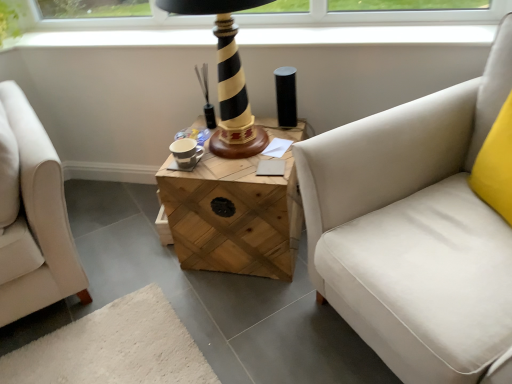
What do you see at coordinates (233, 216) in the screenshot? This screenshot has width=512, height=384. I see `wooden crate at center` at bounding box center [233, 216].

Locate an element on the screen. white fabric studio couch at right is located at coordinates (416, 230).

The width and height of the screenshot is (512, 384). Describe the element at coordinates (416, 230) in the screenshot. I see `white fabric studio couch at right` at that location.

Locate an element on the screen. Image resolution: width=512 pixels, height=384 pixels. wooden crate at center is located at coordinates (233, 216).

In the scene shown: Can you confirm if white fabric studio couch at right is shorter than wooden crate at center?

In fact, white fabric studio couch at right may be taller than wooden crate at center.

Is white fabric studio couch at right in front of wooden crate at center?

Yes, white fabric studio couch at right is in front of wooden crate at center.

Is white fabric studio couch at right turned away from wooden crate at center?

No, white fabric studio couch at right's orientation is not away from wooden crate at center.

From the picture: Considering the relative positions of black striped wood table lamp at center and white fabric studio couch at right in the image provided, is black striped wood table lamp at center to the right of white fabric studio couch at right from the viewer's perspective?

In fact, black striped wood table lamp at center is to the left of white fabric studio couch at right.

From the picture: Between black striped wood table lamp at center and white fabric studio couch at right, which one has smaller size?

black striped wood table lamp at center.

In order to click on table lamp lying behind the white fabric studio couch at right in this screenshot , I will do [x=228, y=78].

Are black striped wood table lamp at center and white fabric studio couch at right located far from each other?

No, black striped wood table lamp at center is not far from white fabric studio couch at right.

Is wooden crate at center next to black striped wood table lamp at center and touching it?

No, wooden crate at center is not making contact with black striped wood table lamp at center.

The image size is (512, 384). What are the coordinates of `table behind the black striped wood table lamp at center` in the screenshot? It's located at 233,216.

From a real-world perspective, which is physically above, wooden crate at center or black striped wood table lamp at center?

black striped wood table lamp at center, from a real-world perspective.

How different are the orientations of black striped wood table lamp at center and wooden crate at center in degrees?

0.000537 degrees separate the facing orientations of black striped wood table lamp at center and wooden crate at center.

Can you confirm if black striped wood table lamp at center is wider than wooden crate at center?

No, black striped wood table lamp at center is not wider than wooden crate at center.

There is a wooden crate at center. Identify the location of table lamp above it (from a real-world perspective). The width and height of the screenshot is (512, 384). (228, 78).

From the image's perspective, between black striped wood table lamp at center and wooden crate at center, who is located below?

wooden crate at center appears lower in the image.

Which is nearer, (x=484, y=277) or (x=222, y=131)?

The point (x=484, y=277) is in front.

Between white fabric studio couch at right and black striped wood table lamp at center, which one has larger size?

white fabric studio couch at right is bigger.

Consider the image. From the image's perspective, is white fabric studio couch at right on top of black striped wood table lamp at center?

No.

Based on the photo, from the image's perspective, is wooden crate at center above or below white fabric studio couch at right?

Clearly, from the image's perspective, wooden crate at center is above white fabric studio couch at right.

Does wooden crate at center have a lesser width compared to white fabric studio couch at right?

Indeed, wooden crate at center has a lesser width compared to white fabric studio couch at right.

Considering the relative positions of wooden crate at center and white fabric studio couch at right in the image provided, is wooden crate at center to the left or to the right of white fabric studio couch at right?

In the image, wooden crate at center appears on the left side of white fabric studio couch at right.

Is wooden crate at center oriented away from white fabric studio couch at right?

No, wooden crate at center is not facing away from white fabric studio couch at right.

Find the location of a particular element. This screenshot has height=384, width=512. table behind the white fabric studio couch at right is located at coordinates (233, 216).

The height and width of the screenshot is (384, 512). Find the location of `studio couch on the right of black striped wood table lamp at center`. studio couch on the right of black striped wood table lamp at center is located at coordinates point(416,230).

From the image, which object appears to be farther from black striped wood table lamp at center, wooden crate at center or white fabric studio couch at right?

Among the two, white fabric studio couch at right is located further to black striped wood table lamp at center.

Considering their positions, is black striped wood table lamp at center positioned closer to white fabric studio couch at right than wooden crate at center?

Among the two, wooden crate at center is located nearer to white fabric studio couch at right.

Estimate the real-world distances between objects in this image. Which object is further from wooden crate at center, white fabric studio couch at right or black striped wood table lamp at center?

white fabric studio couch at right.

In the scene shown: Considering their positions, is black striped wood table lamp at center positioned closer to wooden crate at center than white fabric studio couch at right?

Among the two, black striped wood table lamp at center is located nearer to wooden crate at center.

Which object lies nearer to the anchor point white fabric studio couch at right, wooden crate at center or black striped wood table lamp at center?

Among the two, wooden crate at center is located nearer to white fabric studio couch at right.

Considering their positions, is white fabric studio couch at right positioned further to black striped wood table lamp at center than wooden crate at center?

white fabric studio couch at right is positioned further to the anchor black striped wood table lamp at center.

At what (x,y) coordinates should I click in order to perform the action: click on table lamp located between white fabric studio couch at right and wooden crate at center in the depth direction. Please return your answer as a coordinate pair (x, y). The image size is (512, 384). Looking at the image, I should click on (228, 78).